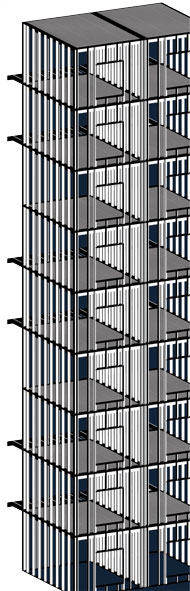
Identify the location of the ninth floor rooms. (103, 87), (173, 79).